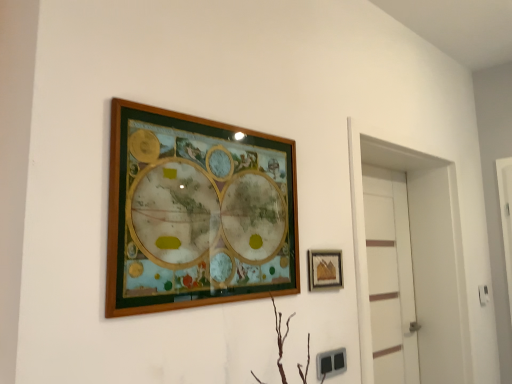
Describe the element at coordinates (420, 255) in the screenshot. I see `white glossy door at right` at that location.

In order to click on matte gold picture frame at right, arranged as the first picture frame when viewed from the right in this screenshot , I will do `click(325, 269)`.

The image size is (512, 384). What are the coordinates of `wooden picture frame at upper center, placed as the second picture frame when sorted from back to front` in the screenshot? It's located at tap(197, 212).

Looking at their sizes, would you say wooden picture frame at upper center, placed as the second picture frame when sorted from back to front, is wider or thinner than matte gold picture frame at right, which is the 2th picture frame from front to back?

Clearly, wooden picture frame at upper center, placed as the second picture frame when sorted from back to front, has more width compared to matte gold picture frame at right, which is the 2th picture frame from front to back.

Is wooden picture frame at upper center, the 1th picture frame when ordered from front to back, with matte gold picture frame at right, arranged as the first picture frame when viewed from the right?

No, wooden picture frame at upper center, the 1th picture frame when ordered from front to back, is not beside matte gold picture frame at right, arranged as the first picture frame when viewed from the right.

Can you tell me how much wooden picture frame at upper center, arranged as the 1th picture frame when viewed from the left, and matte gold picture frame at right, arranged as the 2th picture frame when viewed from the left, differ in facing direction?

They differ by 0.143 degrees in their facing directions.

Who is shorter, wooden picture frame at upper center, which is the 2th picture frame in right-to-left order, or matte gold picture frame at right, arranged as the first picture frame when viewed from the right?

Standing shorter between the two is matte gold picture frame at right, arranged as the first picture frame when viewed from the right.

Do you think white matte door at right is within white glossy door at right, or outside of it?

white matte door at right is enclosed within white glossy door at right.

Is point (393, 370) closer to camera compared to point (441, 286)?

Yes, it is in front of point (441, 286).

From a real-world perspective, is white matte door at right positioned above or below white glossy door at right?

Clearly, from a real-world perspective, white matte door at right is below white glossy door at right.

Looking at this image, from a real-world perspective, is white matte door at right located higher than matte gold picture frame at right, which is the 2th picture frame from front to back?

No, from a real-world perspective, white matte door at right is not on top of matte gold picture frame at right, which is the 2th picture frame from front to back.

Is point (381, 341) positioned in front of point (335, 262)?

No.

Considering the relative sizes of white matte door at right and matte gold picture frame at right, arranged as the 2th picture frame when viewed from the left, in the image provided, is white matte door at right smaller than matte gold picture frame at right, arranged as the 2th picture frame when viewed from the left,?

Incorrect, white matte door at right is not smaller in size than matte gold picture frame at right, arranged as the 2th picture frame when viewed from the left.

In the image, is white matte door at right positioned in front of or behind matte gold picture frame at right, arranged as the 2th picture frame when viewed from the left?

Visually, white matte door at right is located behind matte gold picture frame at right, arranged as the 2th picture frame when viewed from the left.

Is point (155, 279) in front of point (457, 365)?

Yes, it is in front of point (457, 365).

Considering the relative positions of wooden picture frame at upper center, the 1th picture frame when ordered from front to back, and white glossy door at right in the image provided, is wooden picture frame at upper center, the 1th picture frame when ordered from front to back, to the right of white glossy door at right from the viewer's perspective?

No, wooden picture frame at upper center, the 1th picture frame when ordered from front to back, is not to the right of white glossy door at right.

Which object is further away from the camera taking this photo, wooden picture frame at upper center, the 1th picture frame when ordered from front to back, or white glossy door at right?

white glossy door at right is further from the camera.

Is white glossy door at right positioned in front of matte gold picture frame at right, arranged as the 2th picture frame when viewed from the left?

No, white glossy door at right is further to the viewer.

Which of these two, white glossy door at right or matte gold picture frame at right, which is the 2th picture frame from front to back, is bigger?

Bigger between the two is white glossy door at right.

From the image's perspective, is white glossy door at right over matte gold picture frame at right, which is the 2th picture frame from front to back?

No.

Can you confirm if matte gold picture frame at right, which is the 2th picture frame from front to back, is bigger than white matte door at right?

No.

From their relative heights in the image, would you say matte gold picture frame at right, which is the 2th picture frame from front to back, is taller or shorter than white matte door at right?

Considering their sizes, matte gold picture frame at right, which is the 2th picture frame from front to back, has less height than white matte door at right.

Which is in front, white glossy door at right or wooden picture frame at upper center, arranged as the 1th picture frame when viewed from the left?

wooden picture frame at upper center, arranged as the 1th picture frame when viewed from the left.

Can you confirm if white glossy door at right is shorter than wooden picture frame at upper center, arranged as the 1th picture frame when viewed from the left?

In fact, white glossy door at right may be taller than wooden picture frame at upper center, arranged as the 1th picture frame when viewed from the left.

Is point (446, 336) in front of point (200, 283)?

No, (446, 336) is further to viewer.

Is white glossy door at right looking in the opposite direction of wooden picture frame at upper center, arranged as the 1th picture frame when viewed from the left?

No, white glossy door at right is not facing away from wooden picture frame at upper center, arranged as the 1th picture frame when viewed from the left.

Locate an element on the screen. This screenshot has height=384, width=512. picture frame located underneath the wooden picture frame at upper center, arranged as the 1th picture frame when viewed from the left (from a real-world perspective) is located at coordinates (325, 269).

Locate an element on the screen. door lying below the white glossy door at right (from the image's perspective) is located at coordinates (390, 276).

Looking at the image, which one is located closer to white matte door at right, white glossy door at right or wooden picture frame at upper center, which is the 2th picture frame in right-to-left order?

Among the two, white glossy door at right is located nearer to white matte door at right.

Based on their spatial positions, is wooden picture frame at upper center, placed as the second picture frame when sorted from back to front, or matte gold picture frame at right, arranged as the 1th picture frame when viewed from the back, further from white glossy door at right?

wooden picture frame at upper center, placed as the second picture frame when sorted from back to front, lies further to white glossy door at right than the other object.

From the picture: Based on their spatial positions, is wooden picture frame at upper center, the 1th picture frame when ordered from front to back, or white glossy door at right closer to matte gold picture frame at right, arranged as the 1th picture frame when viewed from the back?

wooden picture frame at upper center, the 1th picture frame when ordered from front to back, lies closer to matte gold picture frame at right, arranged as the 1th picture frame when viewed from the back, than the other object.

Looking at the image, which one is located closer to white matte door at right, white glossy door at right or matte gold picture frame at right, arranged as the first picture frame when viewed from the right?

Among the two, white glossy door at right is located nearer to white matte door at right.

When comparing their distances from white matte door at right, does wooden picture frame at upper center, placed as the second picture frame when sorted from back to front, or white glossy door at right seem further?

Based on the image, wooden picture frame at upper center, placed as the second picture frame when sorted from back to front, appears to be further to white matte door at right.

Looking at the image, which one is located further to white glossy door at right, white matte door at right or matte gold picture frame at right, arranged as the 1th picture frame when viewed from the back?

matte gold picture frame at right, arranged as the 1th picture frame when viewed from the back, is further to white glossy door at right.

Based on their spatial positions, is white matte door at right or white glossy door at right closer to matte gold picture frame at right, arranged as the first picture frame when viewed from the right?

Based on the image, white glossy door at right appears to be nearer to matte gold picture frame at right, arranged as the first picture frame when viewed from the right.

Considering their positions, is white matte door at right positioned closer to wooden picture frame at upper center, placed as the second picture frame when sorted from back to front, than matte gold picture frame at right, arranged as the 2th picture frame when viewed from the left?

matte gold picture frame at right, arranged as the 2th picture frame when viewed from the left, is closer to wooden picture frame at upper center, placed as the second picture frame when sorted from back to front.

Find the location of `picture frame between wooden picture frame at upper center, the 1th picture frame when ordered from front to back, and white matte door at right from front to back`. picture frame between wooden picture frame at upper center, the 1th picture frame when ordered from front to back, and white matte door at right from front to back is located at coordinates (325, 269).

Where is `picture frame between wooden picture frame at upper center, placed as the second picture frame when sorted from back to front, and white glossy door at right, in the horizontal direction`? Image resolution: width=512 pixels, height=384 pixels. picture frame between wooden picture frame at upper center, placed as the second picture frame when sorted from back to front, and white glossy door at right, in the horizontal direction is located at coordinates (325, 269).

In order to click on glass door located between matte gold picture frame at right, which is the 2th picture frame from front to back, and white matte door at right in the depth direction in this screenshot , I will do `click(420, 255)`.

At what (x,y) coordinates should I click in order to perform the action: click on glass door positioned between wooden picture frame at upper center, the 1th picture frame when ordered from front to back, and white matte door at right from near to far. Please return your answer as a coordinate pair (x, y). Looking at the image, I should click on (420, 255).